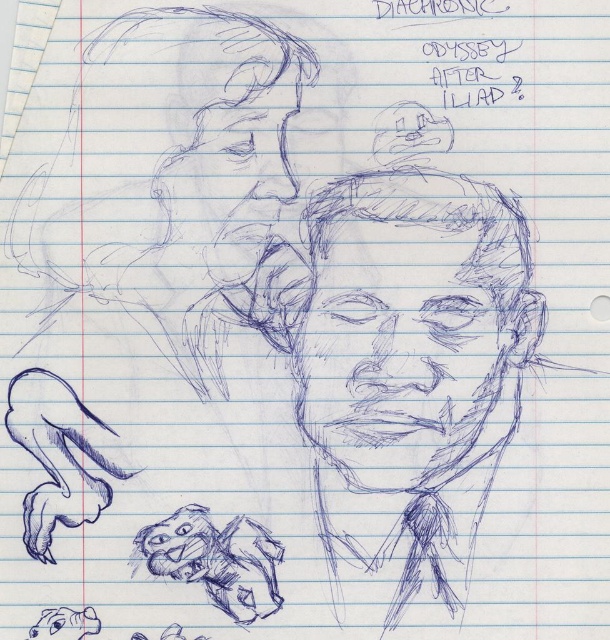
You are an architect designing a scale model of this scene. The man in the drawing has a head that is 12 centimeters tall in the model. How far apart should you place the two points labeled point at point (334, 348)?

The two points labeled point at point (334, 348) are 76.81 centimeters apart in the original scene. In the scale model, if the man has a head that is 12 centimeters tall, the distance between the points should be scaled proportionally. However, without knowing the actual height of the man in the original scene, it is impossible to determine the exact scaled distance.

You are an art student who wants to add a background to the blue pencil sketch face at center. If your arm can reach 1 meter, can you comfortably add details behind the face without moving your chair?

The blue pencil sketch face at center is 75.35 centimeters away from the viewer. Since your arm can reach 1 meter, you can comfortably add details behind the face without moving your chair because the distance is within your reach.

You are an art student analyzing the sketch. You notice two faces in the drawing. Which face is closer to you, the blue pencil sketch face at center or the blue sketchy face at upper left?

The blue pencil sketch face at center is closer to you than the blue sketchy face at upper left.